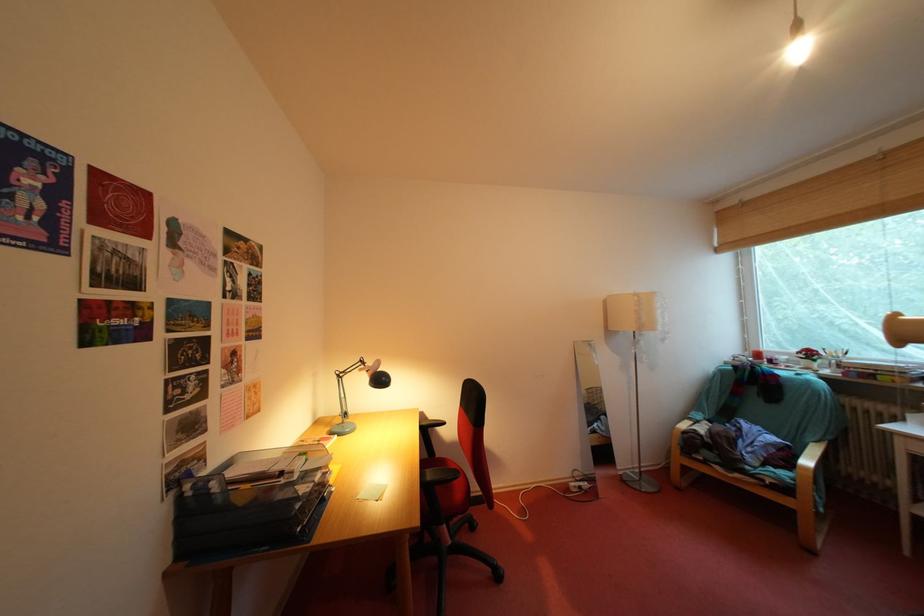
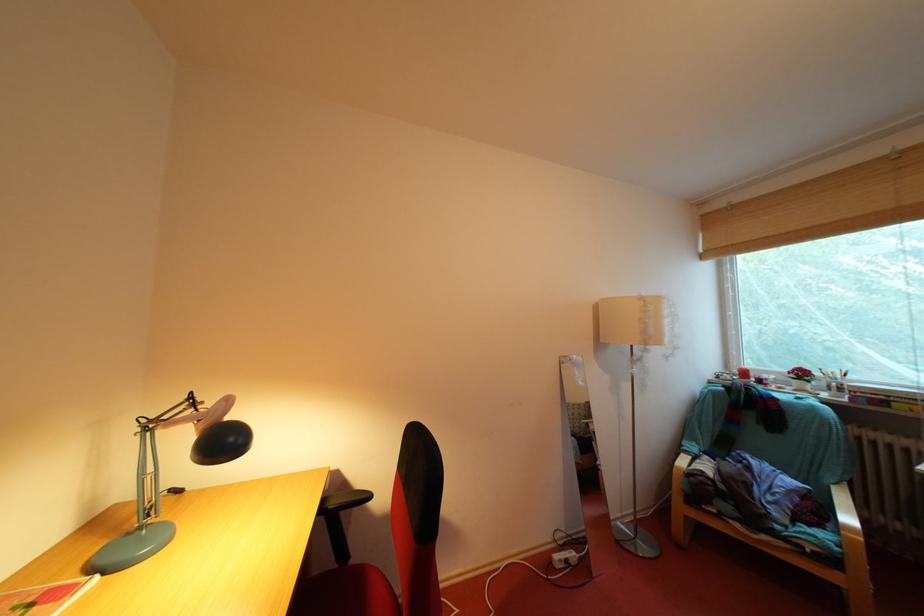
Question: How did the camera likely rotate?

Choices:
 (A) Left
 (B) Right
 (C) Up
 (D) Down

Answer: (B)